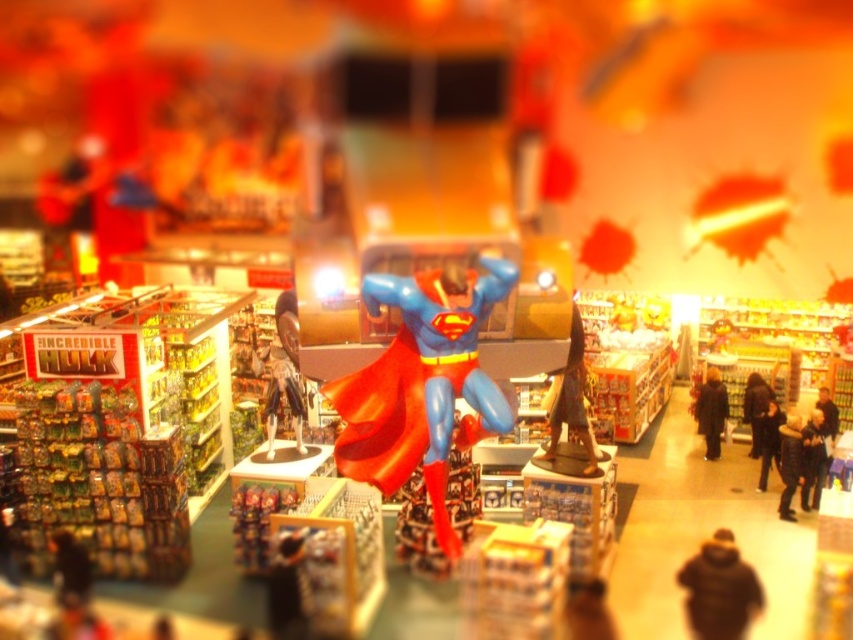
Question: Does shiny metallic figure at center have a lesser width compared to smooth black hoodie at lower left?

Choices:
 (A) no
 (B) yes

Answer: (A)

Question: Which is farther from the dark brown fur coat at center?

Choices:
 (A) bronze statue at center
 (B) blue glossy superman figure at center
 (C) dark brown leather jacket at center

Answer: (C)

Question: Which point is farther to the camera?

Choices:
 (A) smooth black hoodie at lower left
 (B) shiny metallic figure at center
 (C) bronze statue at center
 (D) dark brown fur coat at center

Answer: (D)

Question: Can you confirm if blue glossy superman figure at center is positioned to the left of shiny metallic figure at center?

Choices:
 (A) yes
 (B) no

Answer: (B)

Question: Does blue glossy superman figure at center have a lesser width compared to dark brown leather jacket at center?

Choices:
 (A) yes
 (B) no

Answer: (B)

Question: Among these objects, which one is nearest to the camera?

Choices:
 (A) shiny metallic figure at center
 (B) dark brown leather jacket at center
 (C) dark brown fur coat at center

Answer: (A)